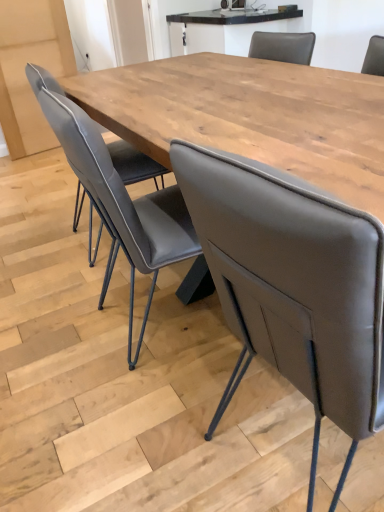
I want to click on wooden table at center, which is the 1th table from front to back, so click(250, 115).

The height and width of the screenshot is (512, 384). Describe the element at coordinates (118, 197) in the screenshot. I see `matte gray leather chair at center, arranged as the 2th chair when viewed from the right` at that location.

In order to face matte gray leather chair at center, arranged as the 2th chair when viewed from the right, should I rotate leftwards or rightwards?

You should look left and rotate roughly 3.802 degrees.

At what (x,y) coordinates should I click in order to perform the action: click on matte gray chair at center, arranged as the first chair when viewed from the right. Please return your answer as a coordinate pair (x, y). This screenshot has height=512, width=384. Looking at the image, I should click on (293, 286).

This screenshot has height=512, width=384. Find the location of `light brown wood table at upper center, which is counted as the first table, starting from the top`. light brown wood table at upper center, which is counted as the first table, starting from the top is located at coordinates (225, 29).

What are the coordinates of `the 2nd table to the right of the matte gray leather chair at center, the 1th chair positioned from the left, counting from the anchor's position` in the screenshot? It's located at (225, 29).

Can you tell me how much matte gray leather chair at center, the 1th chair positioned from the left, and light brown wood table at upper center, the 1th table viewed from the back, differ in facing direction?

There is a 179-degree angle between the facing directions of matte gray leather chair at center, the 1th chair positioned from the left, and light brown wood table at upper center, the 1th table viewed from the back.

From a real-world perspective, is matte gray leather chair at center, arranged as the 2th chair when viewed from the right, physically above light brown wood table at upper center, the 1th table viewed from the back?

No, from a real-world perspective, matte gray leather chair at center, arranged as the 2th chair when viewed from the right, is not on top of light brown wood table at upper center, the 1th table viewed from the back.

From the image's perspective, would you say matte gray leather chair at center, the 1th chair positioned from the left, is positioned over light brown wood table at upper center, the 1th table viewed from the back?

No.

From a real-world perspective, is matte gray chair at center, the 2th chair in the left-to-right sequence, beneath matte gray leather chair at center, the 1th chair positioned from the left?

No, from a real-world perspective, matte gray chair at center, the 2th chair in the left-to-right sequence, is not under matte gray leather chair at center, the 1th chair positioned from the left.

Can you confirm if matte gray chair at center, arranged as the first chair when viewed from the right, is wider than matte gray leather chair at center, the 1th chair positioned from the left?

Indeed, matte gray chair at center, arranged as the first chair when viewed from the right, has a greater width compared to matte gray leather chair at center, the 1th chair positioned from the left.

Consider the image. Is matte gray chair at center, arranged as the first chair when viewed from the right, looking in the opposite direction of matte gray leather chair at center, arranged as the 2th chair when viewed from the right?

No.

Is matte gray chair at center, arranged as the first chair when viewed from the right, inside the boundaries of matte gray leather chair at center, arranged as the 2th chair when viewed from the right, or outside?

The correct answer is: outside.

From a real-world perspective, which object stands above the other?

In real-world perspective, matte gray chair at center, arranged as the first chair when viewed from the right, is above.

Is wooden table at center, which is the first table from bottom to top, turned away from matte gray chair at center, arranged as the first chair when viewed from the right?

Yes.

How different are the orientations of wooden table at center, which is the 2th table in top-to-bottom order, and matte gray chair at center, arranged as the first chair when viewed from the right, in degrees?

The angular difference between wooden table at center, which is the 2th table in top-to-bottom order, and matte gray chair at center, arranged as the first chair when viewed from the right, is 3.6 degrees.

Is matte gray chair at center, arranged as the first chair when viewed from the right, bigger or smaller than wooden table at center, which is the 1th table from front to back?

matte gray chair at center, arranged as the first chair when viewed from the right, is smaller than wooden table at center, which is the 1th table from front to back.

Can you confirm if matte gray chair at center, the 2th chair in the left-to-right sequence, is thinner than wooden table at center, which is the 2th table in top-to-bottom order?

Indeed, matte gray chair at center, the 2th chair in the left-to-right sequence, has a lesser width compared to wooden table at center, which is the 2th table in top-to-bottom order.

Measure the distance between matte gray chair at center, the 2th chair in the left-to-right sequence, and wooden table at center, which is the 1th table from front to back.

A distance of 25.54 inches exists between matte gray chair at center, the 2th chair in the left-to-right sequence, and wooden table at center, which is the 1th table from front to back.

Does point (215, 213) lie in front of point (334, 179)?

Yes, point (215, 213) is closer to viewer.

Who is smaller, wooden table at center, which is the 2th table in top-to-bottom order, or matte gray leather chair at center, the 1th chair positioned from the left?

matte gray leather chair at center, the 1th chair positioned from the left, is smaller.

Is wooden table at center, which is the first table from bottom to top, beside matte gray leather chair at center, the 1th chair positioned from the left?

No, wooden table at center, which is the first table from bottom to top, is not with matte gray leather chair at center, the 1th chair positioned from the left.

In the scene shown: From the image's perspective, would you say wooden table at center, which is the 1th table from front to back, is shown under matte gray leather chair at center, arranged as the 2th chair when viewed from the right?

Actually, wooden table at center, which is the 1th table from front to back, appears above matte gray leather chair at center, arranged as the 2th chair when viewed from the right, in the image.

From the picture: Can you confirm if wooden table at center, which is the 1th table from front to back, is wider than matte gray leather chair at center, arranged as the 2th chair when viewed from the right?

Yes.

Is matte gray leather chair at center, the 1th chair positioned from the left, inside or outside of matte gray chair at center, arranged as the first chair when viewed from the right?

matte gray leather chair at center, the 1th chair positioned from the left, is outside matte gray chair at center, arranged as the first chair when viewed from the right.

From the image's perspective, is matte gray leather chair at center, the 1th chair positioned from the left, on matte gray chair at center, the 2th chair in the left-to-right sequence?

Yes.

From a real-world perspective, is matte gray leather chair at center, the 1th chair positioned from the left, located higher than matte gray chair at center, the 2th chair in the left-to-right sequence?

No, from a real-world perspective, matte gray leather chair at center, the 1th chair positioned from the left, is not above matte gray chair at center, the 2th chair in the left-to-right sequence.

At what (x,y) coordinates should I click in order to perform the action: click on chair in front of the matte gray leather chair at center, arranged as the 2th chair when viewed from the right. Please return your answer as a coordinate pair (x, y). The height and width of the screenshot is (512, 384). Looking at the image, I should click on (293, 286).

How many degrees apart are the facing directions of matte gray chair at center, the 2th chair in the left-to-right sequence, and light brown wood table at upper center, the 1th table viewed from the back?

There is a 177-degree angle between the facing directions of matte gray chair at center, the 2th chair in the left-to-right sequence, and light brown wood table at upper center, the 1th table viewed from the back.

Does matte gray chair at center, arranged as the first chair when viewed from the right, have a lesser width compared to light brown wood table at upper center, the 1th table viewed from the back?

No.

Which is correct: matte gray chair at center, the 2th chair in the left-to-right sequence, is inside light brown wood table at upper center, which is counted as the first table, starting from the top, or outside of it?

matte gray chair at center, the 2th chair in the left-to-right sequence, is outside light brown wood table at upper center, which is counted as the first table, starting from the top.

Is matte gray chair at center, arranged as the first chair when viewed from the right, far from light brown wood table at upper center, which is the second table from bottom to top?

Absolutely, matte gray chair at center, arranged as the first chair when viewed from the right, is distant from light brown wood table at upper center, which is the second table from bottom to top.

Where is `chair located on the left of light brown wood table at upper center, the 1th table viewed from the back`? chair located on the left of light brown wood table at upper center, the 1th table viewed from the back is located at coordinates (118, 197).

At what (x,y) coordinates should I click in order to perform the action: click on chair above the matte gray leather chair at center, arranged as the 2th chair when viewed from the right (from a real-world perspective). Please return your answer as a coordinate pair (x, y). Image resolution: width=384 pixels, height=512 pixels. Looking at the image, I should click on (293, 286).

From the image, which object appears to be farther from matte gray leather chair at center, arranged as the 2th chair when viewed from the right, matte gray chair at center, arranged as the first chair when viewed from the right, or wooden table at center, which is counted as the second table, starting from the back?

matte gray chair at center, arranged as the first chair when viewed from the right, lies further to matte gray leather chair at center, arranged as the 2th chair when viewed from the right, than the other object.

Looking at the image, which one is located closer to matte gray chair at center, arranged as the first chair when viewed from the right, light brown wood table at upper center, which is counted as the first table, starting from the top, or matte gray leather chair at center, arranged as the 2th chair when viewed from the right?

matte gray leather chair at center, arranged as the 2th chair when viewed from the right, is closer to matte gray chair at center, arranged as the first chair when viewed from the right.

Consider the image. Which object lies further to the anchor point matte gray leather chair at center, arranged as the 2th chair when viewed from the right, light brown wood table at upper center, which is counted as the first table, starting from the top, or matte gray chair at center, the 2th chair in the left-to-right sequence?

light brown wood table at upper center, which is counted as the first table, starting from the top, is further to matte gray leather chair at center, arranged as the 2th chair when viewed from the right.

Which object lies further to the anchor point matte gray leather chair at center, arranged as the 2th chair when viewed from the right, light brown wood table at upper center, the 1th table viewed from the back, or wooden table at center, which is the 2th table in top-to-bottom order?

light brown wood table at upper center, the 1th table viewed from the back, is further to matte gray leather chair at center, arranged as the 2th chair when viewed from the right.

Based on their spatial positions, is matte gray chair at center, arranged as the first chair when viewed from the right, or wooden table at center, which is the first table from bottom to top, closer to light brown wood table at upper center, the 1th table viewed from the back?

wooden table at center, which is the first table from bottom to top, lies closer to light brown wood table at upper center, the 1th table viewed from the back, than the other object.

From the image, which object appears to be farther from light brown wood table at upper center, which is the second table from bottom to top, matte gray leather chair at center, the 1th chair positioned from the left, or wooden table at center, which is counted as the second table, starting from the back?

Among the two, matte gray leather chair at center, the 1th chair positioned from the left, is located further to light brown wood table at upper center, which is the second table from bottom to top.

Which object lies further to the anchor point matte gray chair at center, arranged as the first chair when viewed from the right, light brown wood table at upper center, which is the second table from bottom to top, or wooden table at center, which is counted as the second table, starting from the back?

light brown wood table at upper center, which is the second table from bottom to top, is positioned further to the anchor matte gray chair at center, arranged as the first chair when viewed from the right.

Looking at the image, which one is located closer to matte gray chair at center, the 2th chair in the left-to-right sequence, wooden table at center, which is the 1th table from front to back, or light brown wood table at upper center, which is counted as the 2th table, starting from the front?

wooden table at center, which is the 1th table from front to back, lies closer to matte gray chair at center, the 2th chair in the left-to-right sequence, than the other object.

At what (x,y) coordinates should I click in order to perform the action: click on table positioned between matte gray chair at center, arranged as the first chair when viewed from the right, and light brown wood table at upper center, which is counted as the 2th table, starting from the front, from near to far. Please return your answer as a coordinate pair (x, y). The width and height of the screenshot is (384, 512). Looking at the image, I should click on (250, 115).

This screenshot has height=512, width=384. Identify the location of chair between wooden table at center, which is counted as the second table, starting from the back, and light brown wood table at upper center, which is the second table from bottom to top, in the front-back direction. (118, 197).

At what (x,y) coordinates should I click in order to perform the action: click on chair located between matte gray chair at center, the 2th chair in the left-to-right sequence, and light brown wood table at upper center, the 1th table viewed from the back, in the depth direction. Please return your answer as a coordinate pair (x, y). The width and height of the screenshot is (384, 512). Looking at the image, I should click on (118, 197).

Locate an element on the screen. The image size is (384, 512). table positioned between matte gray chair at center, the 2th chair in the left-to-right sequence, and matte gray leather chair at center, the 1th chair positioned from the left, from near to far is located at coordinates (250, 115).